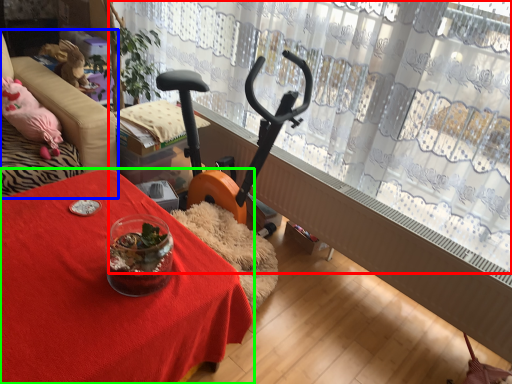
Question: Estimate the real-world distances between objects in this image. Which object is farther from curtain (highlighted by a red box), furniture (highlighted by a blue box) or table (highlighted by a green box)?

Choices:
 (A) furniture
 (B) table

Answer: (B)